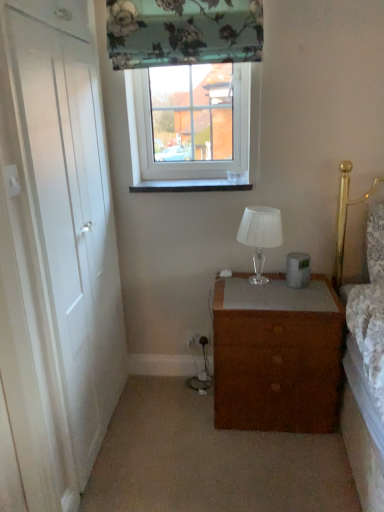
In order to click on free space that is in between white wooden door at left and brown matte chest of drawers at center in this screenshot , I will do `click(168, 428)`.